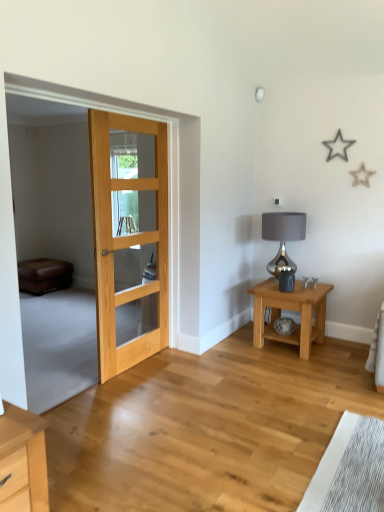
Question: From a real-world perspective, is natural wood door at left positioned over shiny metallic lamp at right based on gravity?

Choices:
 (A) yes
 (B) no

Answer: (A)

Question: Could you tell me if natural wood door at left is facing shiny metallic lamp at right?

Choices:
 (A) yes
 (B) no

Answer: (B)

Question: Is natural wood door at left beside shiny metallic lamp at right?

Choices:
 (A) yes
 (B) no

Answer: (B)

Question: Does natural wood door at left contain shiny metallic lamp at right?

Choices:
 (A) no
 (B) yes

Answer: (A)

Question: Can you confirm if natural wood door at left is thinner than shiny metallic lamp at right?

Choices:
 (A) yes
 (B) no

Answer: (A)

Question: Does natural wood door at left have a smaller size compared to shiny metallic lamp at right?

Choices:
 (A) yes
 (B) no

Answer: (B)

Question: From a real-world perspective, does shiny metallic lamp at right stand above natural wood door at left?

Choices:
 (A) yes
 (B) no

Answer: (B)

Question: Considering the relative sizes of shiny metallic lamp at right and natural wood door at left in the image provided, is shiny metallic lamp at right shorter than natural wood door at left?

Choices:
 (A) no
 (B) yes

Answer: (B)

Question: From a real-world perspective, is shiny metallic lamp at right physically below natural wood door at left?

Choices:
 (A) yes
 (B) no

Answer: (A)

Question: From the image's perspective, is shiny metallic lamp at right on top of natural wood door at left?

Choices:
 (A) no
 (B) yes

Answer: (A)

Question: Does shiny metallic lamp at right appear on the left side of natural wood door at left?

Choices:
 (A) yes
 (B) no

Answer: (B)

Question: Is shiny metallic lamp at right next to natural wood door at left?

Choices:
 (A) no
 (B) yes

Answer: (A)

Question: From the image's perspective, does natural wood door at left appear lower than brown leather couch at left?

Choices:
 (A) no
 (B) yes

Answer: (A)